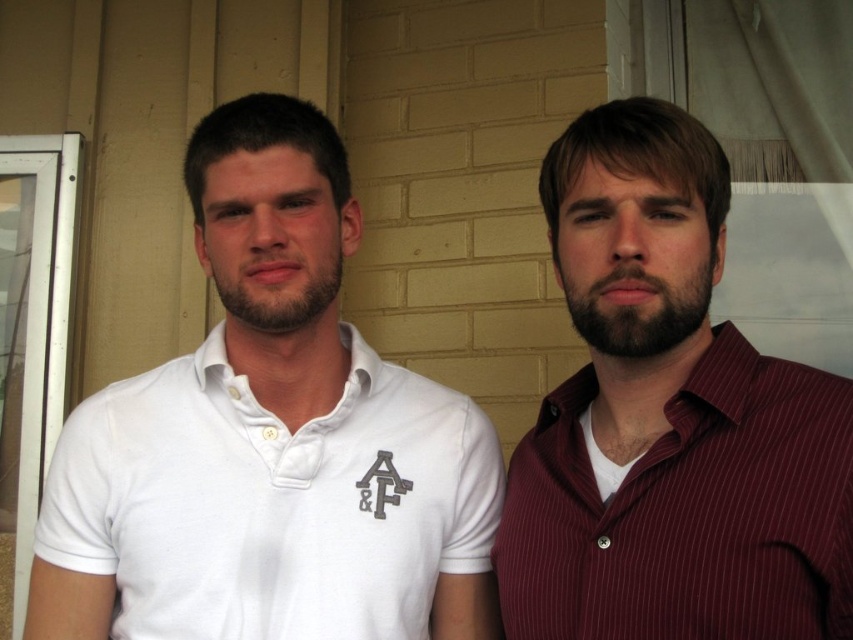
You are a photographer setting up a shoot. You need to place a camera on a tripod between the white cotton polo shirt at left and the maroon striped shirt at right. Based on their positions, which direction should you point the camera to capture both shirts in the frame?

The white cotton polo shirt at left is positioned on the left side of maroon striped shirt at right. To capture both shirts in the frame, you should point the camera towards the center between them.

You are a photographer setting up a photo shoot with two models wearing the white cotton polo shirt at left and the maroon striped shirt at right. The camera is positioned to capture both shirts in the frame. Which shirt should you adjust to ensure both are equally visible in height?

The white cotton polo shirt at left is taller than the maroon striped shirt at right. To make them equally visible in height, lower the white cotton polo shirt at left or raise the maroon striped shirt at right.